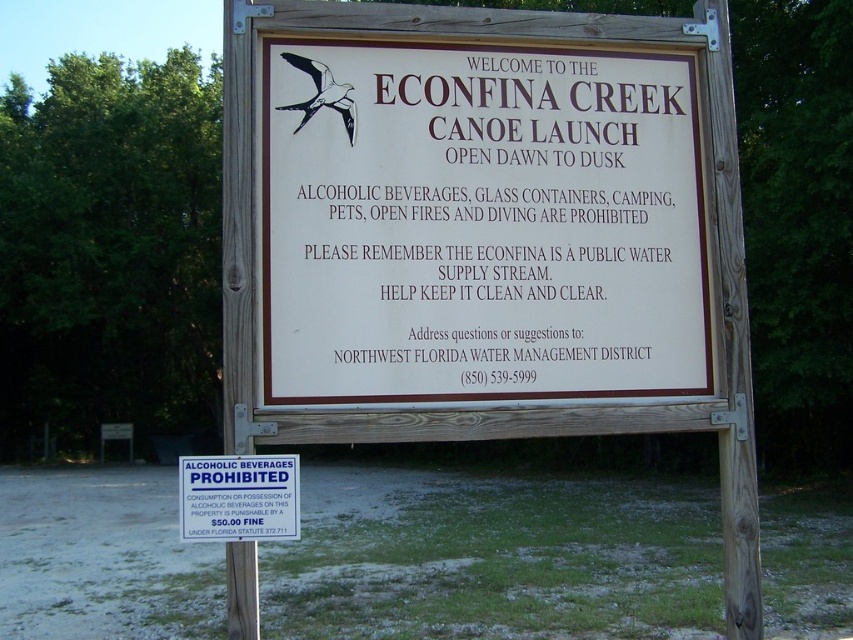
Looking at this image, does white wood sign at center appear over blue plastic sign at center?

Yes, white wood sign at center is above blue plastic sign at center.

Does white wood sign at center have a larger size compared to blue plastic sign at center?

Yes, white wood sign at center is bigger than blue plastic sign at center.

Is point (633, 49) behind point (253, 468)?

That is True.

The height and width of the screenshot is (640, 853). In order to click on white wood sign at center in this screenshot , I will do `click(480, 225)`.